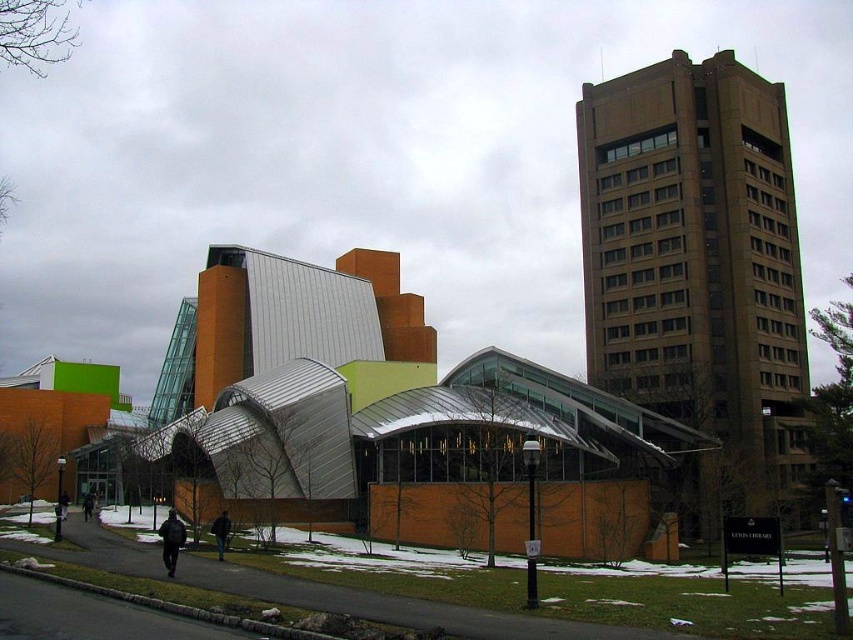
Question: Among these points, which one is farthest from the camera?

Choices:
 (A) (183, 531)
 (B) (93, 499)
 (C) (606, 177)
 (D) (67, 493)

Answer: (C)

Question: Based on their relative distances, which object is farther from the black leather jacket at lower left?

Choices:
 (A) brown brick building at upper right
 (B) dark gray jacket at lower left
 (C) dark blue jacket at lower center
 (D) dark blue jacket at center

Answer: (A)

Question: Which object is closer to the camera taking this photo?

Choices:
 (A) dark blue jacket at center
 (B) dark blue jacket at lower center
 (C) brown brick building at upper right

Answer: (B)

Question: Is black leather jacket at lower left closer to the viewer compared to dark blue jacket at center?

Choices:
 (A) no
 (B) yes

Answer: (B)

Question: Can you confirm if brown brick building at upper right is smaller than dark blue jacket at lower center?

Choices:
 (A) yes
 (B) no

Answer: (B)

Question: Does black leather jacket at lower left have a greater width compared to dark blue jacket at center?

Choices:
 (A) yes
 (B) no

Answer: (A)